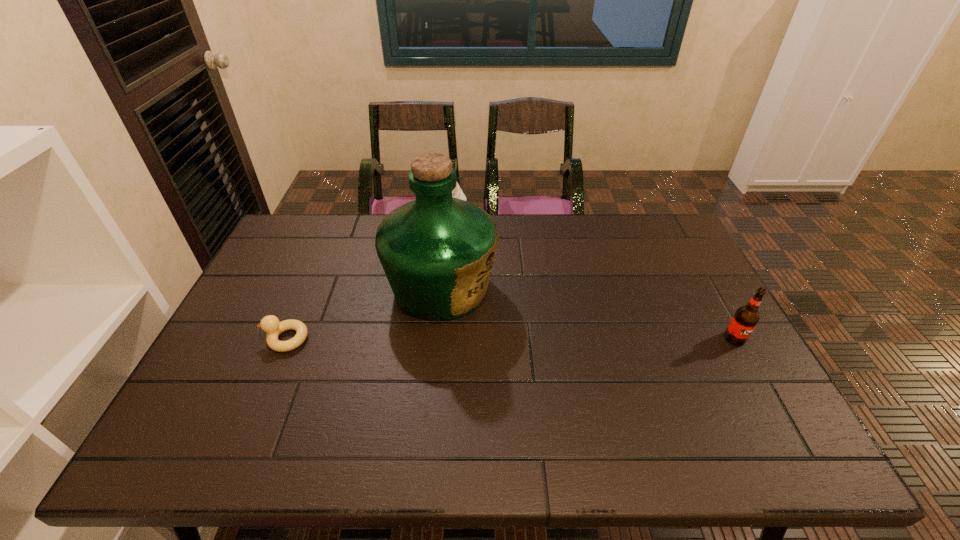
Where is `the shortest object`? the shortest object is located at coordinates (270, 324).

Where is `duckling`? The height and width of the screenshot is (540, 960). duckling is located at coordinates (270, 324).

The image size is (960, 540). In order to click on the rightmost object in this screenshot , I will do `click(745, 319)`.

The width and height of the screenshot is (960, 540). I want to click on icecream, so click(x=457, y=192).

Find the location of `liquor`. liquor is located at coordinates (437, 252).

Locate an element on the screen. This screenshot has height=540, width=960. vacant space located at the beak of the leftmost object is located at coordinates (245, 339).

This screenshot has width=960, height=540. Identify the location of vacant space located on the back of the rightmost object. (687, 253).

Identify the location of vacant space positioned 0.130m on the front-facing side of the farthest object. This screenshot has height=540, width=960. (461, 247).

This screenshot has height=540, width=960. Identify the location of free location located on the front-facing side of the farthest object. (465, 285).

Find the location of `free spot located 0.090m on the front-facing side of the farthest object`. free spot located 0.090m on the front-facing side of the farthest object is located at coordinates (460, 240).